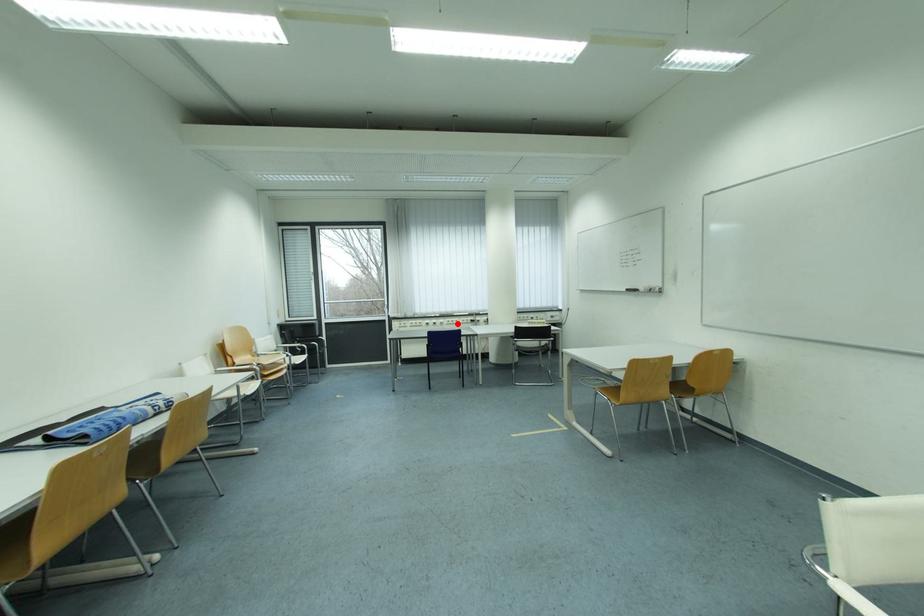
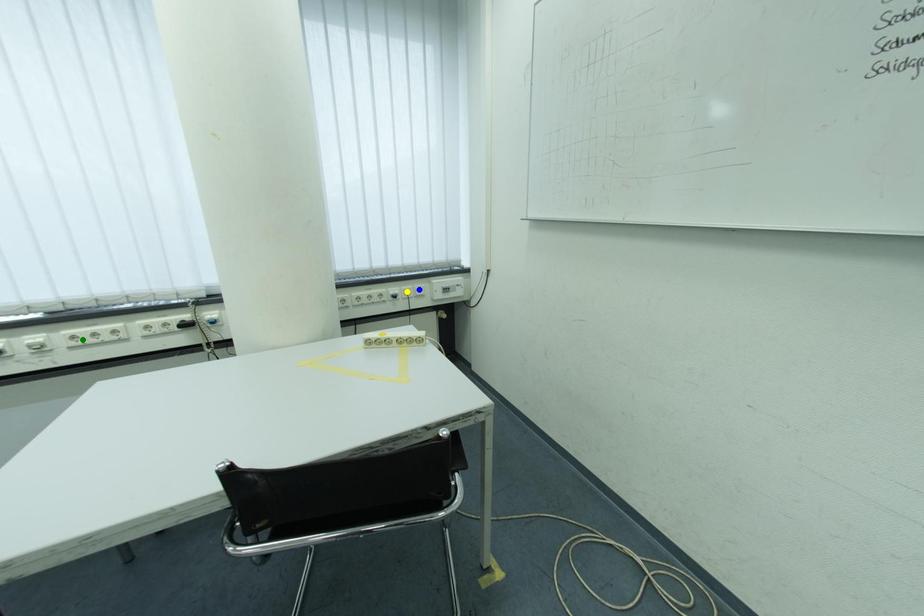
Question: I am providing you with two images of the same scene from different viewpoints. A red point is marked on the first image. You are given multiple points on the second image. Can you choose the point in image 2 that corresponds to the point in image 1?

Choices:
 (A) blue point
 (B) yellow point
 (C) green point

Answer: (C)